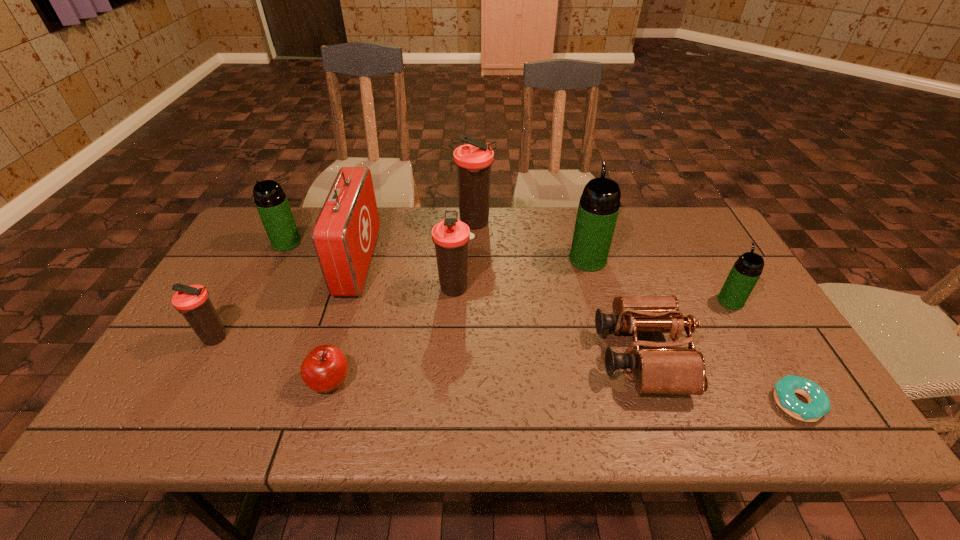
Image resolution: width=960 pixels, height=540 pixels. What are the coordinates of `the first-aid kit that is at the far edge` in the screenshot? It's located at (344, 235).

Locate an element on the screen. This screenshot has height=540, width=960. binoculars located at the near edge is located at coordinates (664, 368).

This screenshot has width=960, height=540. Find the location of `apple at the near edge`. apple at the near edge is located at coordinates coord(325,368).

Locate an element on the screen. This screenshot has width=960, height=540. doughnut located in the near edge section of the desktop is located at coordinates (819, 404).

The height and width of the screenshot is (540, 960). In order to click on thermos bottle that is at the right edge in this screenshot , I will do `click(746, 271)`.

Locate an element on the screen. doughnut at the right edge is located at coordinates (819, 404).

Where is `object that is at the far left corner`? The height and width of the screenshot is (540, 960). object that is at the far left corner is located at coordinates (271, 202).

Locate an element on the screen. object located at the near right corner is located at coordinates (819, 404).

In the image, there is a desktop. At what (x,y) coordinates should I click in order to perform the action: click on free space at the far edge. Please return your answer as a coordinate pair (x, y). This screenshot has width=960, height=540. Looking at the image, I should click on (532, 214).

Where is `vacant space at the near edge`? vacant space at the near edge is located at coordinates (239, 417).